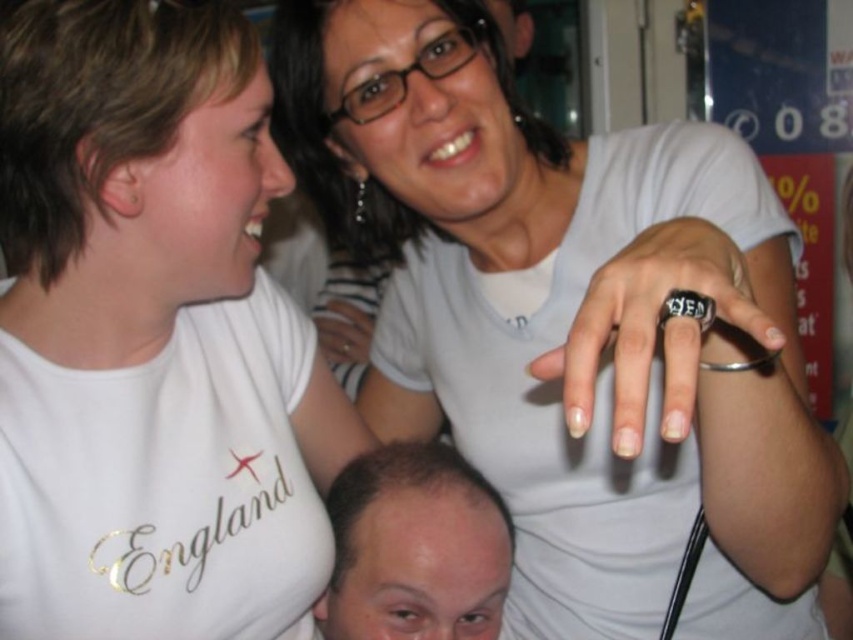
Question: Which object is positioned farthest from the white matte t-shirt at upper left?

Choices:
 (A) white matte ring at upper center
 (B) smooth bald head at lower center

Answer: (A)

Question: Based on their relative distances, which object is farther from the white matte ring at upper center?

Choices:
 (A) smooth bald head at lower center
 (B) white matte t-shirt at upper left

Answer: (B)

Question: In this image, where is white matte ring at upper center located relative to smooth bald head at lower center?

Choices:
 (A) below
 (B) above

Answer: (B)

Question: Does white matte ring at upper center have a smaller size compared to smooth bald head at lower center?

Choices:
 (A) yes
 (B) no

Answer: (B)

Question: Where is white matte ring at upper center located in relation to white matte t-shirt at upper left in the image?

Choices:
 (A) left
 (B) right

Answer: (B)

Question: Among these points, which one is farthest from the camera?

Choices:
 (A) (646, 506)
 (B) (361, 634)
 (C) (187, 144)

Answer: (A)